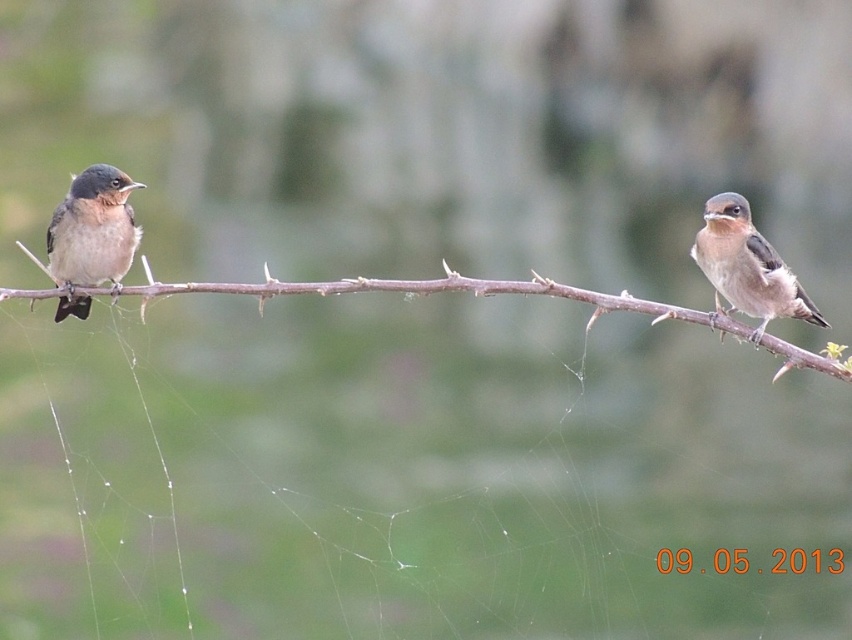
Is the position of brown textured branch at center more distant than that of brown matte bird at right?

No, brown textured branch at center is closer to the viewer.

The height and width of the screenshot is (640, 852). Identify the location of brown textured branch at center. (435, 292).

Between point (488, 288) and point (703, 216), which one is positioned in front?

Point (488, 288) is more forward.

Where is `brown textured branch at center`? This screenshot has width=852, height=640. brown textured branch at center is located at coordinates (435, 292).

Based on the photo, between brown textured branch at center and brown matte bird at left, which one is positioned higher?

brown matte bird at left

Find the location of a particular element. brown textured branch at center is located at coordinates (435, 292).

The height and width of the screenshot is (640, 852). What are the coordinates of `brown textured branch at center` in the screenshot? It's located at (435, 292).

Between brown matte bird at left and brown matte bird at right, which one appears on the right side from the viewer's perspective?

Positioned to the right is brown matte bird at right.

You are a GUI agent. You are given a task and a screenshot of the screen. Output one action in this format:
    pyautogui.click(x=<x>, y=<y>)
    Task: Click on the brown matte bird at left
    This screenshot has width=852, height=640.
    Given the screenshot: What is the action you would take?
    pyautogui.click(x=91, y=236)

Measure the distance between brown matte bird at left and camera.

brown matte bird at left and camera are 3.41 meters apart.

Image resolution: width=852 pixels, height=640 pixels. I want to click on brown matte bird at left, so click(91, 236).